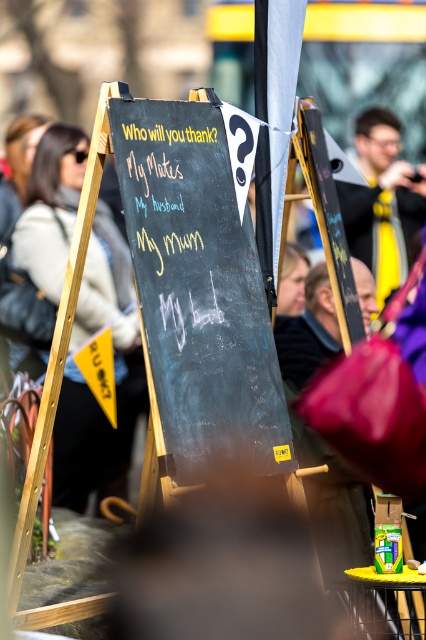
Does point (247, 429) come closer to viewer compared to point (104, 268)?

Yes, point (247, 429) is in front of point (104, 268).

You are a GUI agent. You are given a task and a screenshot of the screen. Output one action in this format:
    pyautogui.click(x=<x>, y=<y>)
    Task: Click on the black chalkboard at center
    This screenshot has height=640, width=426.
    Given the screenshot: What is the action you would take?
    pyautogui.click(x=198, y=292)

Is point (178, 161) closer to camera compared to point (78, 432)?

Yes.

The image size is (426, 640). Find the location of `black chalkboard at center`. black chalkboard at center is located at coordinates (198, 292).